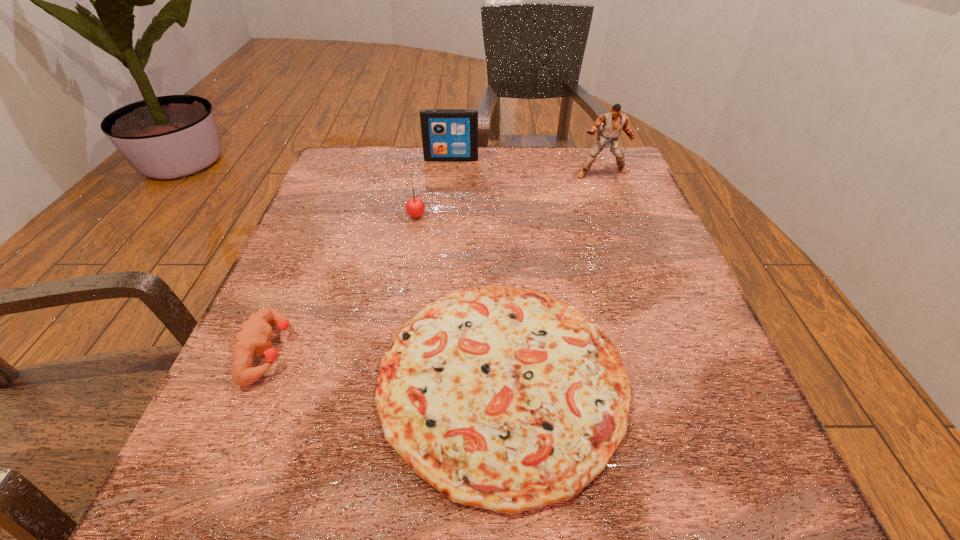
The width and height of the screenshot is (960, 540). I want to click on object located in the far right corner section of the desktop, so click(x=613, y=122).

You are a GUI agent. You are given a task and a screenshot of the screen. Output one action in this format:
    pyautogui.click(x=<x>, y=<y>)
    Task: Click on the object located at the near right corner
    The image size is (960, 540).
    Given the screenshot: What is the action you would take?
    pyautogui.click(x=502, y=398)

The height and width of the screenshot is (540, 960). Identify the location of free space at the far edge. (399, 157).

The image size is (960, 540). I want to click on vacant area at the left edge, so click(358, 274).

The image size is (960, 540). Identify the location of free space at the right edge of the desktop. 610,306.

What are the coordinates of `vacant space at the far left corner of the desktop` in the screenshot? It's located at (378, 193).

This screenshot has height=540, width=960. What are the coordinates of `vacant space at the near left corner` in the screenshot? It's located at (276, 519).

In the image, there is a desktop. Identify the location of vacant space at the far right corner. (612, 153).

Image resolution: width=960 pixels, height=540 pixels. In the image, there is a desktop. Find the location of `free space at the near right corner`. free space at the near right corner is located at coordinates (689, 460).

This screenshot has width=960, height=540. I want to click on free space between the third farthest object and the nearer puncher, so click(x=343, y=283).